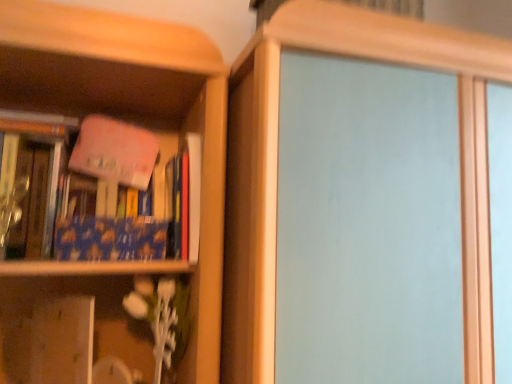
Question: Considering the positions of blue matte book at left, which ranks as the 1th book in left-to-right order, and transparent glass screen door at center in the image, is blue matte book at left, which ranks as the 1th book in left-to-right order, wider or thinner than transparent glass screen door at center?

Choices:
 (A) wide
 (B) thin

Answer: (B)

Question: From the image's perspective, relative to transparent glass screen door at center, is blue matte book at left, which ranks as the 1th book in left-to-right order, above or below?

Choices:
 (A) below
 (B) above

Answer: (B)

Question: Considering the real-world distances, which object is closest to the wooden vase at lower left?

Choices:
 (A) transparent glass screen door at center
 (B) pink matte book at upper left, which is counted as the first book, starting from the right
 (C) blue matte book at left, which ranks as the 1th book in left-to-right order

Answer: (C)

Question: Estimate the real-world distances between objects in this image. Which object is farther from the pink matte book at upper left, which is counted as the first book, starting from the right?

Choices:
 (A) blue matte book at left, which is counted as the second book, starting from the right
 (B) transparent glass screen door at center
 (C) wooden vase at lower left

Answer: (B)